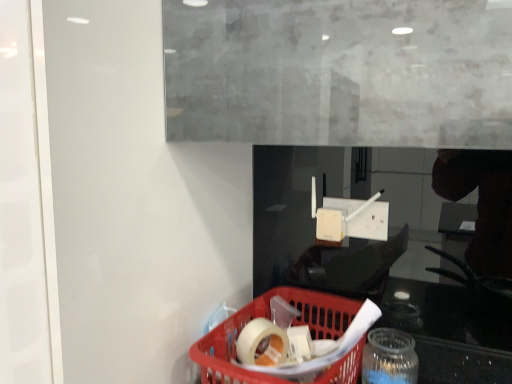
Question: Is translucent plastic basket at lower center far from red plastic basket at lower center?

Choices:
 (A) yes
 (B) no

Answer: (B)

Question: Considering the relative sizes of translucent plastic basket at lower center and red plastic basket at lower center in the image provided, is translucent plastic basket at lower center smaller than red plastic basket at lower center?

Choices:
 (A) no
 (B) yes

Answer: (B)

Question: Considering the relative positions of translucent plastic basket at lower center and red plastic basket at lower center in the image provided, is translucent plastic basket at lower center to the left of red plastic basket at lower center from the viewer's perspective?

Choices:
 (A) yes
 (B) no

Answer: (A)

Question: Could you tell me if translucent plastic basket at lower center is turned towards red plastic basket at lower center?

Choices:
 (A) yes
 (B) no

Answer: (A)

Question: Is translucent plastic basket at lower center shorter than red plastic basket at lower center?

Choices:
 (A) no
 (B) yes

Answer: (B)

Question: Considering the relative positions of translucent plastic basket at lower center and red plastic basket at lower center in the image provided, is translucent plastic basket at lower center to the right of red plastic basket at lower center from the viewer's perspective?

Choices:
 (A) yes
 (B) no

Answer: (B)

Question: From the image's perspective, would you say red plastic basket at lower center is positioned over transparent glass jar at lower right?

Choices:
 (A) no
 (B) yes

Answer: (B)

Question: Is red plastic basket at lower center behind transparent glass jar at lower right?

Choices:
 (A) yes
 (B) no

Answer: (B)

Question: Is red plastic basket at lower center next to transparent glass jar at lower right?

Choices:
 (A) no
 (B) yes

Answer: (A)

Question: Does red plastic basket at lower center have a smaller size compared to transparent glass jar at lower right?

Choices:
 (A) yes
 (B) no

Answer: (B)

Question: Is red plastic basket at lower center to the left of transparent glass jar at lower right from the viewer's perspective?

Choices:
 (A) yes
 (B) no

Answer: (A)

Question: Can you confirm if red plastic basket at lower center is bigger than transparent glass jar at lower right?

Choices:
 (A) no
 (B) yes

Answer: (B)

Question: Does transparent glass jar at lower right appear on the right side of translucent plastic basket at lower center?

Choices:
 (A) yes
 (B) no

Answer: (A)